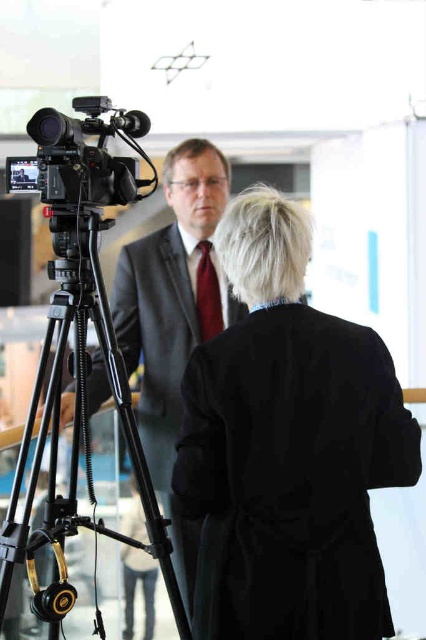
You are a technician setting up a video recording session. You need to ensure that the black matte coat at center and the black matte camera at left are both visible in the frame. Given their sizes, which object might require adjustment to fit into the frame?

The black matte coat at center has a larger width than the black matte camera at left, so it might require adjustment to fit into the frame.

You are an assistant helping to set up the video recording equipment. You need to place a small microphone stand between the black matte coat at center and the maroon silk tie at center. Based on their heights, which object should the microphone stand be placed closer to?

The microphone stand should be placed closer to the maroon silk tie at center because the black matte coat at center is taller and might block the microphone signal or obstruct the view.